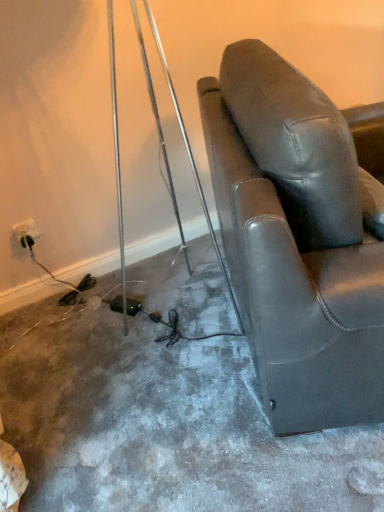
Locate an element on the screen. matte black leather chair at right is located at coordinates (297, 239).

What do you see at coordinates (297, 239) in the screenshot? Image resolution: width=384 pixels, height=512 pixels. I see `matte black leather chair at right` at bounding box center [297, 239].

Locate an element on the screen. The height and width of the screenshot is (512, 384). white plastic outlet at lower left is located at coordinates (26, 232).

This screenshot has width=384, height=512. Describe the element at coordinates (26, 232) in the screenshot. I see `white plastic outlet at lower left` at that location.

What is the approximate width of white plastic outlet at lower left?

white plastic outlet at lower left is 2.17 inches in width.

Measure the distance between point [23,221] and camera.

Point [23,221] and camera are 1.67 meters apart.

This screenshot has width=384, height=512. Find the location of `matte black leather chair at right`. matte black leather chair at right is located at coordinates (297, 239).

Is matte black leather chair at right at the right side of white plastic outlet at lower left?

Result: Correct, you'll find matte black leather chair at right to the right of white plastic outlet at lower left.

Is the position of matte black leather chair at right more distant than that of white plastic outlet at lower left?

No, it is in front of white plastic outlet at lower left.

Between point (267, 390) and point (36, 229), which one is positioned behind?

The point (36, 229) is farther.

From the image's perspective, which one is positioned lower, matte black leather chair at right or white plastic outlet at lower left?

white plastic outlet at lower left is shown below in the image.

From a real-world perspective, is matte black leather chair at right below white plastic outlet at lower left?

No, from a real-world perspective, matte black leather chair at right is not beneath white plastic outlet at lower left.

Considering the sizes of objects matte black leather chair at right and white plastic outlet at lower left in the image provided, who is thinner, matte black leather chair at right or white plastic outlet at lower left?

white plastic outlet at lower left is thinner.

Considering the relative sizes of matte black leather chair at right and white plastic outlet at lower left in the image provided, is matte black leather chair at right shorter than white plastic outlet at lower left?

No.

Is matte black leather chair at right bigger than white plastic outlet at lower left?

Yes, matte black leather chair at right is bigger than white plastic outlet at lower left.

Is matte black leather chair at right not within white plastic outlet at lower left?

Yes, matte black leather chair at right is located beyond the bounds of white plastic outlet at lower left.

Would you say matte black leather chair at right is a long distance from white plastic outlet at lower left?

Yes, matte black leather chair at right and white plastic outlet at lower left are located far from each other.

Is matte black leather chair at right facing away from white plastic outlet at lower left?

That's right, matte black leather chair at right is facing away from white plastic outlet at lower left.

How many degrees apart are the facing directions of matte black leather chair at right and white plastic outlet at lower left?

The angle between the facing direction of matte black leather chair at right and the facing direction of white plastic outlet at lower left is 66.6 degrees.

At what (x,y) coordinates should I click in order to perform the action: click on chair on the right of white plastic outlet at lower left. Please return your answer as a coordinate pair (x, y). The width and height of the screenshot is (384, 512). Looking at the image, I should click on (297, 239).

Consider the image. Considering the relative positions of white plastic outlet at lower left and matte black leather chair at right in the image provided, is white plastic outlet at lower left to the right of matte black leather chair at right from the viewer's perspective?

Incorrect, white plastic outlet at lower left is not on the right side of matte black leather chair at right.

Looking at this image, considering their positions, is white plastic outlet at lower left located in front of or behind matte black leather chair at right?

In the image, white plastic outlet at lower left appears behind matte black leather chair at right.

Which point is more distant from viewer, (27,222) or (279,303)?

The point (27,222) is farther from the camera.

From the image's perspective, is white plastic outlet at lower left on top of matte black leather chair at right?

No, from the image's perspective, white plastic outlet at lower left is not above matte black leather chair at right.

From a real-world perspective, is white plastic outlet at lower left over matte black leather chair at right?

No.

Between white plastic outlet at lower left and matte black leather chair at right, which one has smaller width?

white plastic outlet at lower left is thinner.

Is white plastic outlet at lower left shorter than matte black leather chair at right?

Correct, white plastic outlet at lower left is not as tall as matte black leather chair at right.

Between white plastic outlet at lower left and matte black leather chair at right, which one has larger size?

matte black leather chair at right.

Is white plastic outlet at lower left completely or partially outside of matte black leather chair at right?

Yes.

Is white plastic outlet at lower left positioned far away from matte black leather chair at right?

Yes.

In the scene shown: Is white plastic outlet at lower left turned away from matte black leather chair at right?

No, white plastic outlet at lower left is not facing away from matte black leather chair at right.

Can you tell me how much white plastic outlet at lower left and matte black leather chair at right differ in facing direction?

The facing directions of white plastic outlet at lower left and matte black leather chair at right are 66.6 degrees apart.

Where is `chair in front of the white plastic outlet at lower left`? The image size is (384, 512). chair in front of the white plastic outlet at lower left is located at coordinates (297, 239).

The image size is (384, 512). In the image, there is a matte black leather chair at right. Identify the location of electric outlet below it (from a real-world perspective). (26, 232).

At what (x,y) coordinates should I click in order to perform the action: click on chair above the white plastic outlet at lower left (from a real-world perspective). Please return your answer as a coordinate pair (x, y). The width and height of the screenshot is (384, 512). Looking at the image, I should click on (297, 239).